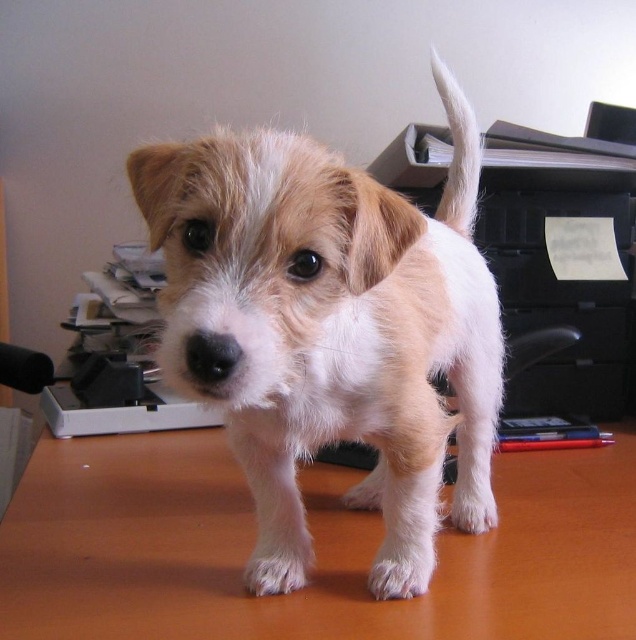
Based on the scene description, where is the fuzzy white dog at center located in terms of coordinates?

The fuzzy white dog at center is located at point coordinates of (329, 330).

You are trying to place a 20 inch long ruler on the brown wooden desk at center so that it reaches from the edge of the desk to the white fluffy tail at upper right. Will the ruler be long enough to span that distance?

The brown wooden desk at center and white fluffy tail at upper right are 18.49 inches apart. Since the ruler is 20 inches long, it will be long enough to span the distance between them.